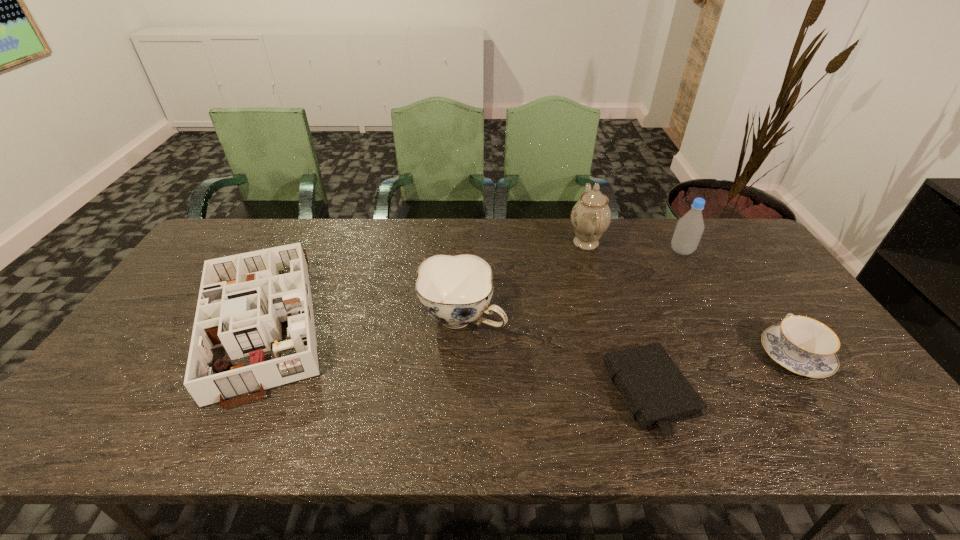
Where is `free region that satisfies the following two spatial constraints: 1. with the handle on the side of the rightmost object; 2. on the spout of the tallest chinaware`? Image resolution: width=960 pixels, height=540 pixels. free region that satisfies the following two spatial constraints: 1. with the handle on the side of the rightmost object; 2. on the spout of the tallest chinaware is located at coordinates (717, 242).

Locate an element on the screen. Image resolution: width=960 pixels, height=540 pixels. blank area in the image that satisfies the following two spatial constraints: 1. on the spout of the farthest chinaware; 2. with the handle on the side of the shortest chinaware is located at coordinates (620, 355).

Image resolution: width=960 pixels, height=540 pixels. I want to click on free space that satisfies the following two spatial constraints: 1. on the spout of the second chinaware from right to left; 2. with the handle on the side of the shortest chinaware, so click(620, 355).

The width and height of the screenshot is (960, 540). Identify the location of vacant space that satisfies the following two spatial constraints: 1. on the spout of the tallest chinaware; 2. on the back side of the Bible. (632, 395).